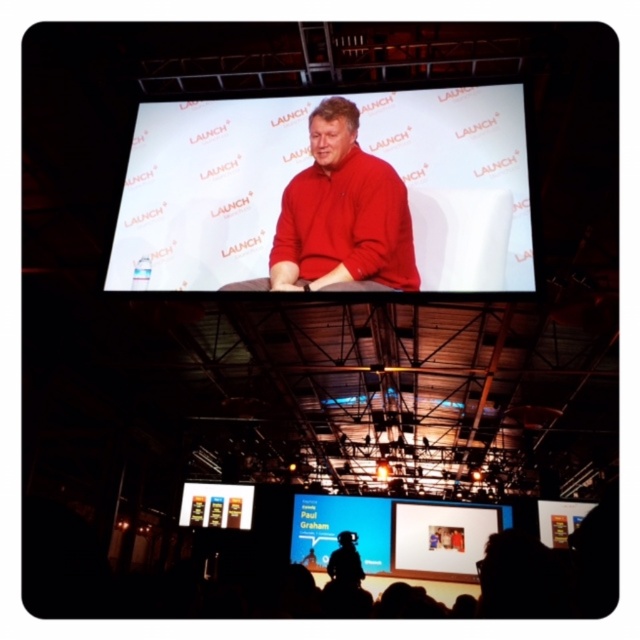
Can you confirm if matte white screen at center is taller than silhouette figure at center?

Incorrect, matte white screen at center's height is not larger of silhouette figure at center's.

Does point (269, 104) come in front of point (332, 577)?

Yes, point (269, 104) is in front of point (332, 577).

What are the coordinates of `matte white screen at center` in the screenshot? It's located at (328, 195).